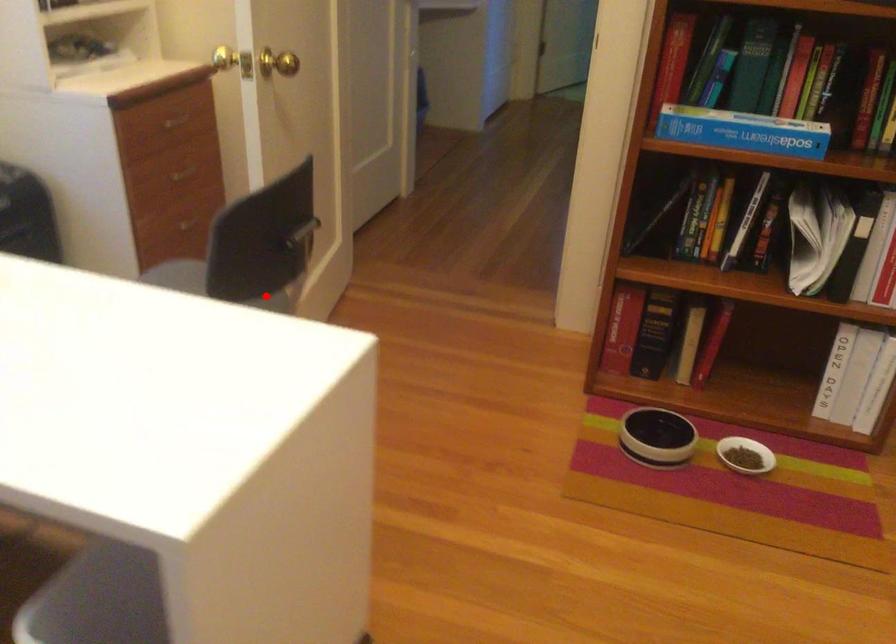
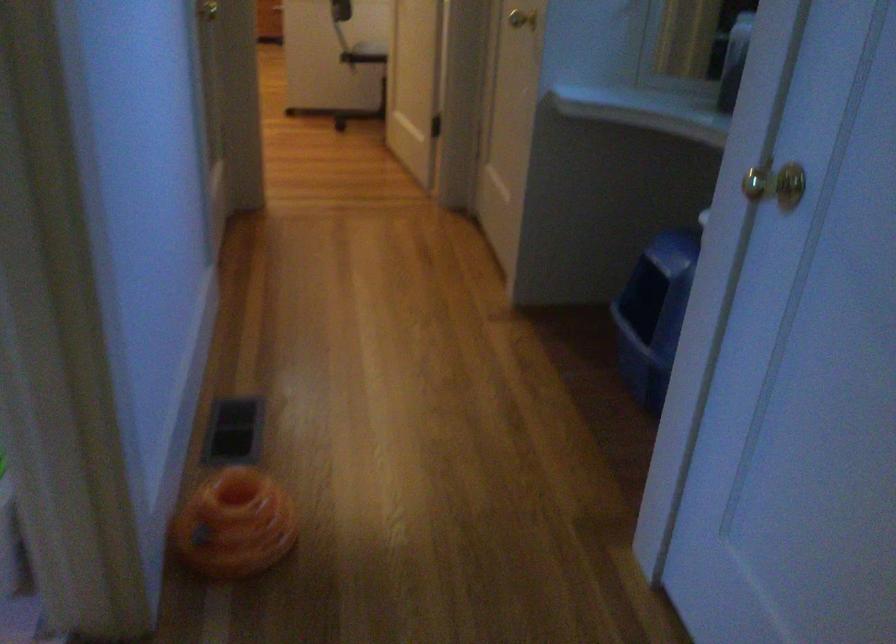
Question: I am providing you with two images of the same scene from different viewpoints. A red point is shown in image1. For the corresponding object point in image2, is it positioned nearer or farther from the camera?

Choices:
 (A) Nearer
 (B) Farther

Answer: (B)